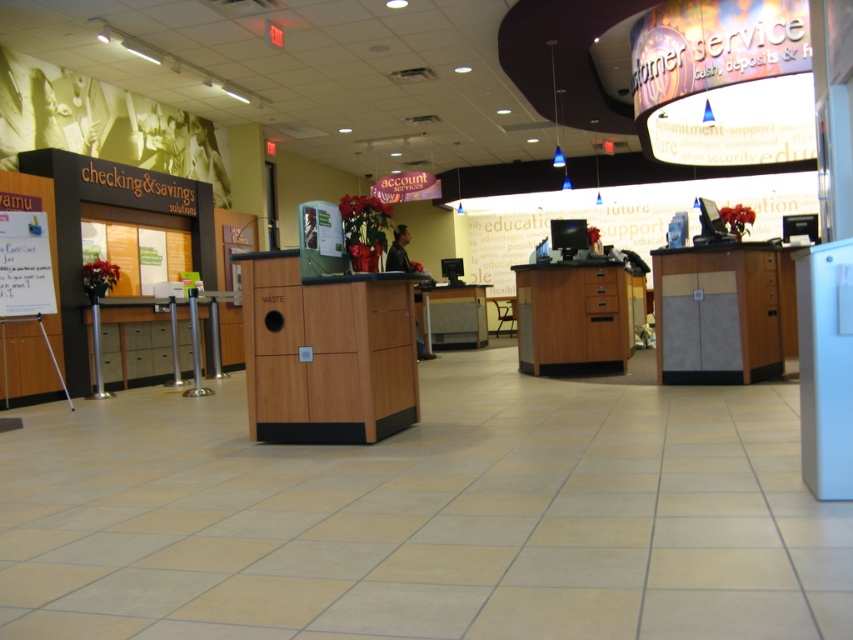
Question: Can you confirm if wooden cabinet at center is thinner than wooden desk at center?

Choices:
 (A) yes
 (B) no

Answer: (A)

Question: Is wooden cabinet at center to the left of wooden desk at center from the viewer's perspective?

Choices:
 (A) yes
 (B) no

Answer: (A)

Question: Which object is positioned farthest from the matte wood desk at right?

Choices:
 (A) wooden desk at center
 (B) wooden cabinet at center

Answer: (B)

Question: Estimate the real-world distances between objects in this image. Which object is closer to the matte wood desk at right?

Choices:
 (A) wooden desk at center
 (B) wooden cabinet at center

Answer: (A)

Question: Can you confirm if matte wood desk at right is positioned to the left of wooden desk at center?

Choices:
 (A) no
 (B) yes

Answer: (A)

Question: Which of these objects is positioned closest to the wooden desk at center?

Choices:
 (A) wooden cabinet at center
 (B) matte wood desk at right

Answer: (B)